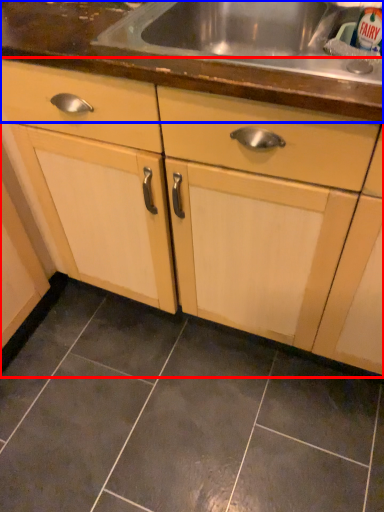
Question: Among these objects, which one is nearest to the camera, cabinetry (highlighted by a red box) or countertop (highlighted by a blue box)?

Choices:
 (A) cabinetry
 (B) countertop

Answer: (A)